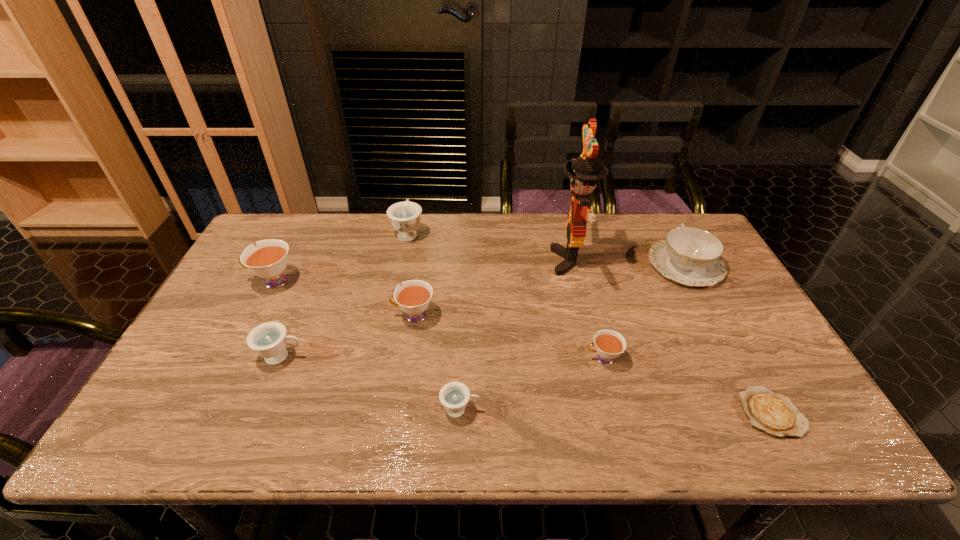
The height and width of the screenshot is (540, 960). I want to click on white teacup that is the second closest to the nutcracker, so coord(414,296).

What are the coordinates of `the second closest blue teacup relative to the farthest white teacup` in the screenshot? It's located at (405, 216).

Find the location of a particular element. The width and height of the screenshot is (960, 540). blue teacup that stands as the third closest to the blue chinaware is located at coordinates (269, 340).

The width and height of the screenshot is (960, 540). I want to click on free point that satisfies the following two spatial constraints: 1. on the back side of the shortest object; 2. on the side of the second farthest blue teacup with the handle, so click(741, 356).

The width and height of the screenshot is (960, 540). In order to click on vacant space that satisfies the following two spatial constraints: 1. on the back side of the quiche; 2. on the side of the second smallest white teacup with the handle in this screenshot , I will do `click(719, 316)`.

Locate an element on the screen. This screenshot has height=540, width=960. vacant area that satisfies the following two spatial constraints: 1. on the side of the brown quiche with the handle; 2. on the left side of the nearest white teacup is located at coordinates pos(616,413).